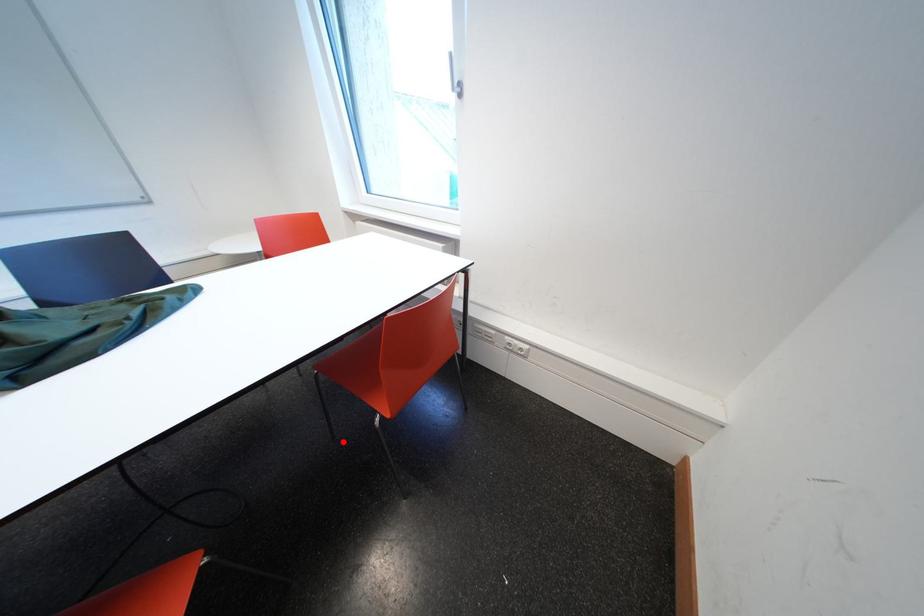
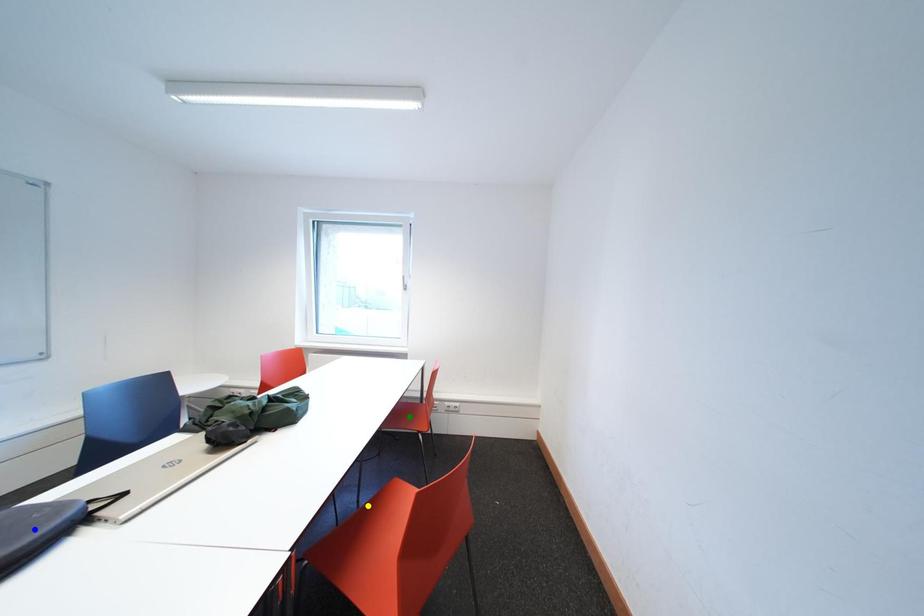
Question: I am providing you with two images of the same scene from different viewpoints. A red point is marked on the first image. You are given multiple points on the second image. Which point in image 2 represents the same 3d spot as the red point in image 1?

Choices:
 (A) yellow point
 (B) green point
 (C) blue point

Answer: (A)